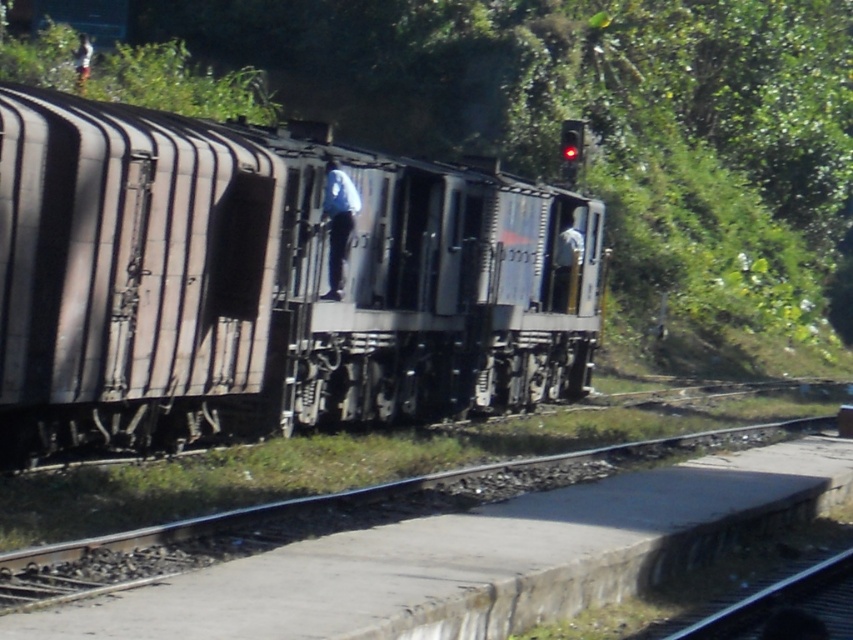
Looking at this image, you are standing on the platform at the railway station and want to walk from point A to point B. Point A is located at coordinates point (114, 224) and point B is at point (712, 451). Given that the platform has a low wall separating it from the tracks, which direction should you walk to reach point B without crossing the tracks?

To reach point B at point (712, 451) from point A at point (114, 224) without crossing the tracks, you should walk towards the direction where point A is in front of point B. Since point A is in front of point B, moving away from the tracks towards the background would keep you on the platform and avoid crossing the tracks.

You are a maintenance worker at the station. You need to place a 2.5 meter tall safety sign so it can be seen from both the rusty metal train at center and the smooth concrete platform at lower center. Where should you place it?

The rusty metal train at center is taller than the smooth concrete platform at lower center. To ensure visibility from both, place the safety sign at a height between the two, so it can be seen by those on the taller train and those on the lower platform.